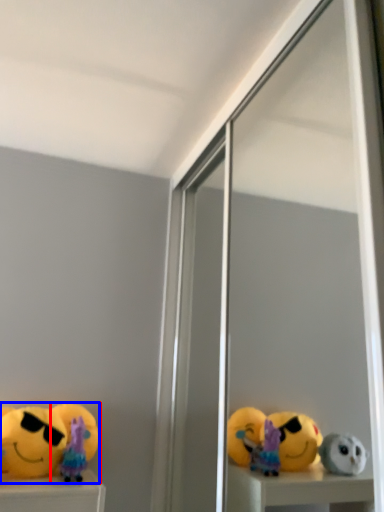
Question: Which of the following is the closest to the observer, toy (highlighted by a red box) or toy (highlighted by a blue box)?

Choices:
 (A) toy
 (B) toy

Answer: (B)